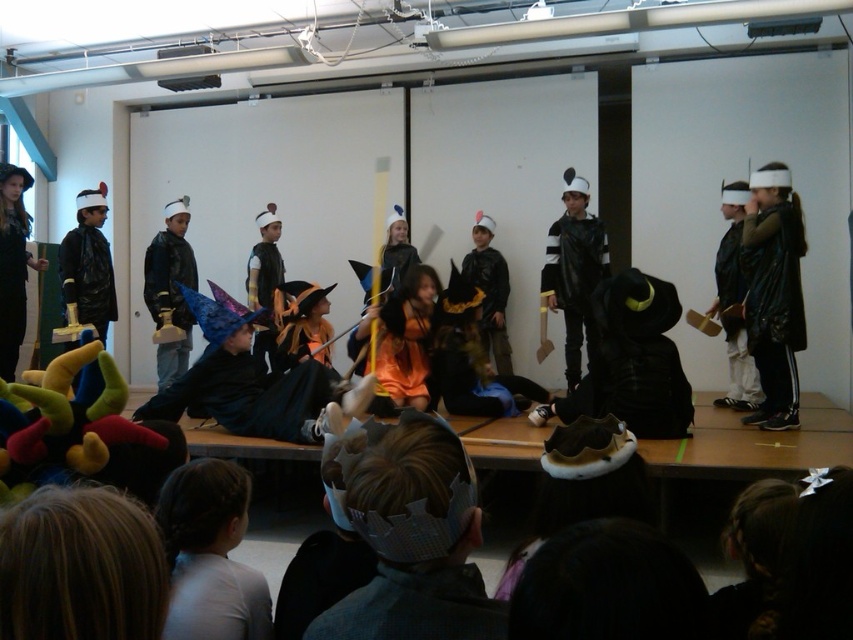
You are standing at the origin point of the stage coordinate system. The stage has a coordinate system where the bottom left corner is at point 0,0 and the top right corner is at point 1,1. You want to place a new prop at the same location as the matte black cape at center. What coordinates should you use?

The coordinates for the matte black cape at center are at point (170,292). Therefore, you should place the new prop at coordinates (170,292) to match its position.

You are a photographer taking pictures of the children on stage. You notice a light brown hair at lower left at point (210, 554). If you want to zoom in on this hair, which direction should you move your camera?

To zoom in on the light brown hair at lower left at point (210, 554), you should move the camera downward and to the left.